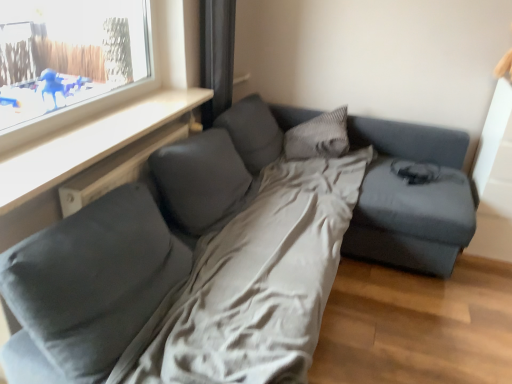
What do you see at coordinates (319, 137) in the screenshot?
I see `gray textured pillow at center` at bounding box center [319, 137].

The image size is (512, 384). I want to click on gray textured pillow at center, so tap(319, 137).

Locate an element on the screen. Image resolution: width=512 pixels, height=384 pixels. gray textured pillow at center is located at coordinates (319, 137).